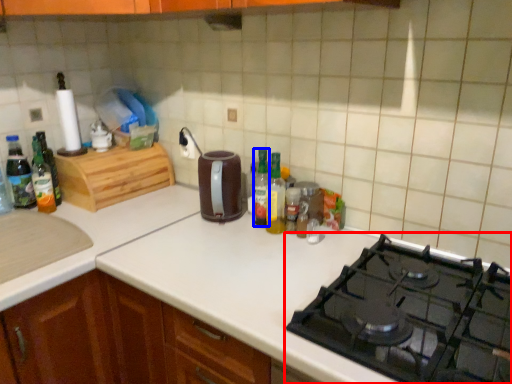
Question: Which object appears closest to the camera in this image, gas stove (highlighted by a red box) or bottle (highlighted by a blue box)?

Choices:
 (A) gas stove
 (B) bottle

Answer: (A)